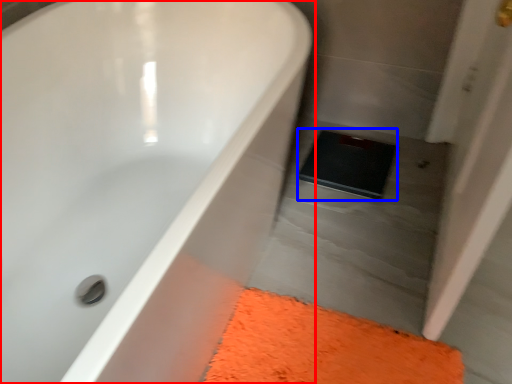
Question: Which object is closer to the camera taking this photo, bathtub (highlighted by a red box) or pad (highlighted by a blue box)?

Choices:
 (A) bathtub
 (B) pad

Answer: (A)